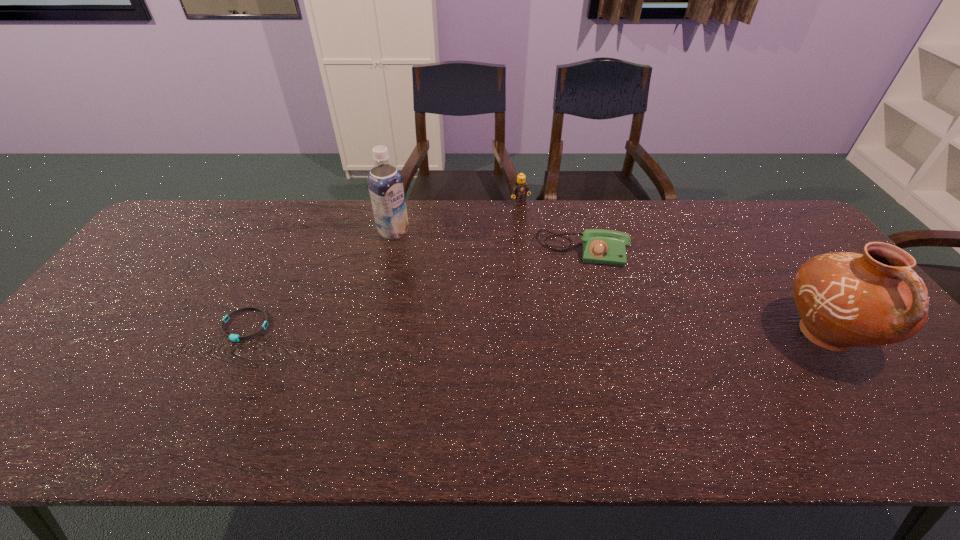
This screenshot has height=540, width=960. In order to click on vacant space located 0.070m on the label of the second object from left to right in this screenshot , I will do `click(419, 248)`.

You are a GUI agent. You are given a task and a screenshot of the screen. Output one action in this format:
    pyautogui.click(x=<x>, y=<y>)
    Task: Click on the free location located 0.240m on the dial of the telephone
    
    Given the screenshot: What is the action you would take?
    pyautogui.click(x=577, y=331)

I want to click on blank space located on the dial of the telephone, so coord(577,302).

I want to click on vacant region located 0.190m on the dial of the telephone, so click(577, 316).

The image size is (960, 540). Identify the location of vacant space located 0.130m in front of the farthest object. (540, 229).

The width and height of the screenshot is (960, 540). I want to click on free spot located 0.320m in front of the farthest object, so [x=568, y=266].

Identify the location of free space located 0.370m in front of the farthest object. The width and height of the screenshot is (960, 540). (577, 277).

Find the location of a particular element. soya milk that is at the far edge is located at coordinates (385, 183).

The image size is (960, 540). Find the location of `telephone located at the far edge`. telephone located at the far edge is located at coordinates (600, 246).

Where is `Lego present at the far edge`? The height and width of the screenshot is (540, 960). Lego present at the far edge is located at coordinates (520, 190).